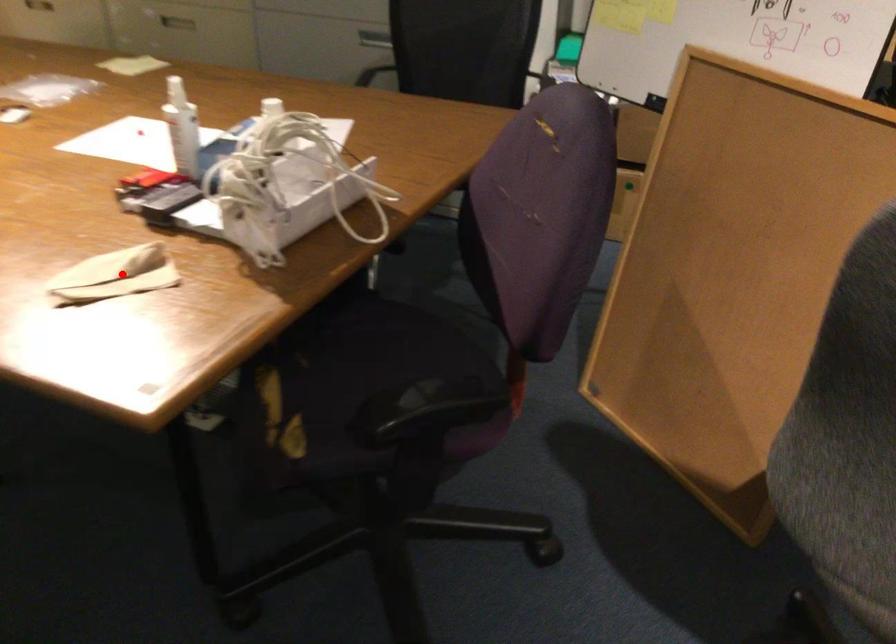
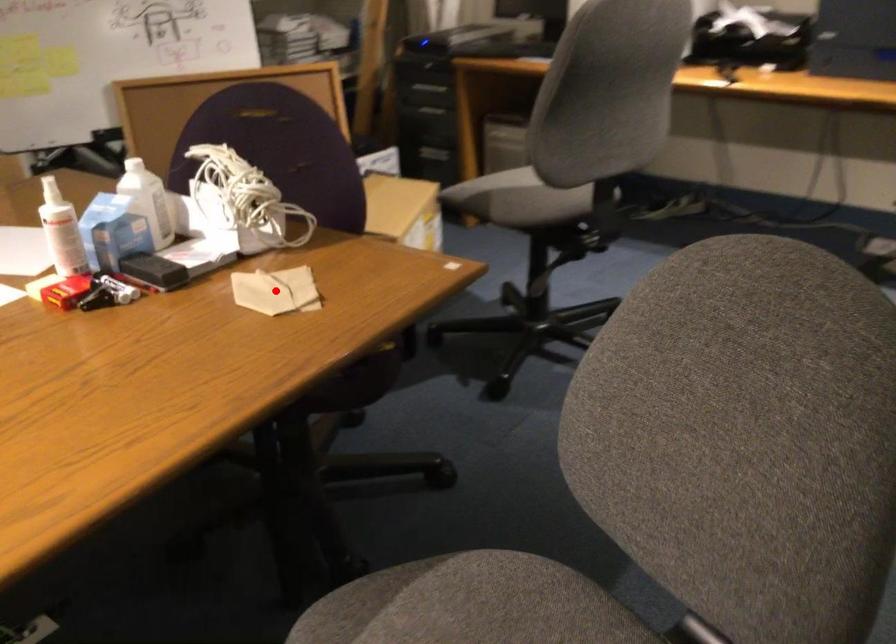
I am providing you with two images of the same scene from different viewpoints. A red point is marked on the first image and another point is marked on the second image. Is the red point in image1 aligned with the point shown in image2?

Yes